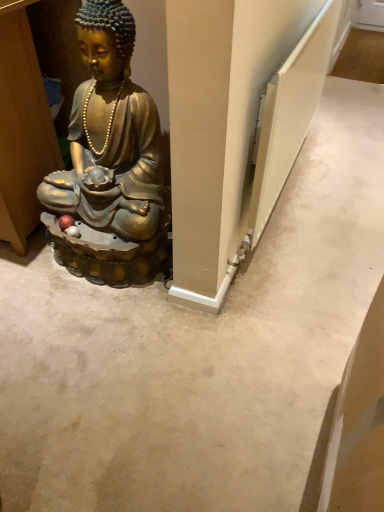
What do you see at coordinates (290, 114) in the screenshot? This screenshot has height=512, width=384. I see `white textured radiator at right` at bounding box center [290, 114].

Where is `white textured radiator at right`? white textured radiator at right is located at coordinates (290, 114).

Where is `gold metallic statue at left`? The width and height of the screenshot is (384, 512). gold metallic statue at left is located at coordinates (110, 134).

The image size is (384, 512). What do you see at coordinates (110, 134) in the screenshot?
I see `gold metallic statue at left` at bounding box center [110, 134].

You are a GUI agent. You are given a task and a screenshot of the screen. Output one action in this format:
    pyautogui.click(x=<x>, y=<y>)
    Task: Click on the white textured radiator at right
    The height and width of the screenshot is (512, 384).
    Given the screenshot: What is the action you would take?
    pyautogui.click(x=290, y=114)

Is white textured radiator at right to the left of gold metallic statue at left from the viewer's perspective?

No, white textured radiator at right is not to the left of gold metallic statue at left.

Does white textured radiator at right come in front of gold metallic statue at left?

No, white textured radiator at right is further to the viewer.

Which is behind, point (302, 132) or point (137, 238)?

The point (302, 132) is behind.

From the image's perspective, is white textured radiator at right beneath gold metallic statue at left?

No, from the image's perspective, white textured radiator at right is not beneath gold metallic statue at left.

From a real-world perspective, is white textured radiator at right positioned under gold metallic statue at left based on gravity?

Actually, white textured radiator at right is physically above gold metallic statue at left in the real world.

Which of these two, white textured radiator at right or gold metallic statue at left, is thinner?

With smaller width is white textured radiator at right.

Considering the relative sizes of white textured radiator at right and gold metallic statue at left in the image provided, is white textured radiator at right shorter than gold metallic statue at left?

Yes.

Considering the relative sizes of white textured radiator at right and gold metallic statue at left in the image provided, is white textured radiator at right bigger than gold metallic statue at left?

No, white textured radiator at right is not bigger than gold metallic statue at left.

Which is correct: white textured radiator at right is inside gold metallic statue at left, or outside of it?

white textured radiator at right lies outside gold metallic statue at left.

In the scene shown: Are white textured radiator at right and gold metallic statue at left located far from each other?

No, white textured radiator at right is in close proximity to gold metallic statue at left.

Is white textured radiator at right turned away from gold metallic statue at left?

Correct, white textured radiator at right is looking away from gold metallic statue at left.

In the image, there is a gold metallic statue at left. Identify the location of radiator above it (from the image's perspective). (290, 114).

Can you confirm if gold metallic statue at left is positioned to the left of white textured radiator at right?

Yes.

Which object is further away from the camera, gold metallic statue at left or white textured radiator at right?

white textured radiator at right.

Which is less distant, [112,48] or [292,78]?

The point [112,48] is closer.

From the image's perspective, which is below, gold metallic statue at left or white textured radiator at right?

gold metallic statue at left, from the image's perspective.

From a real-world perspective, who is located higher, gold metallic statue at left or white textured radiator at right?

From a 3D spatial view, white textured radiator at right is above.

Does gold metallic statue at left have a greater width compared to white textured radiator at right?

Yes, gold metallic statue at left is wider than white textured radiator at right.

In the scene shown: Considering the relative sizes of gold metallic statue at left and white textured radiator at right in the image provided, is gold metallic statue at left shorter than white textured radiator at right?

In fact, gold metallic statue at left may be taller than white textured radiator at right.

Is gold metallic statue at left smaller than white textured radiator at right?

No, gold metallic statue at left is not smaller than white textured radiator at right.

Is gold metallic statue at left not within white textured radiator at right?

That's correct, gold metallic statue at left is outside of white textured radiator at right.

Is gold metallic statue at left not close to white textured radiator at right?

No.

Is gold metallic statue at left facing away from white textured radiator at right?

gold metallic statue at left does not have its back to white textured radiator at right.

The height and width of the screenshot is (512, 384). Find the location of `person directly beneath the white textured radiator at right (from a real-world perspective)`. person directly beneath the white textured radiator at right (from a real-world perspective) is located at coordinates (110, 134).

In order to click on person that appears below the white textured radiator at right (from the image's perspective) in this screenshot , I will do `click(110, 134)`.

Where is `person in front of the white textured radiator at right`? person in front of the white textured radiator at right is located at coordinates (110, 134).